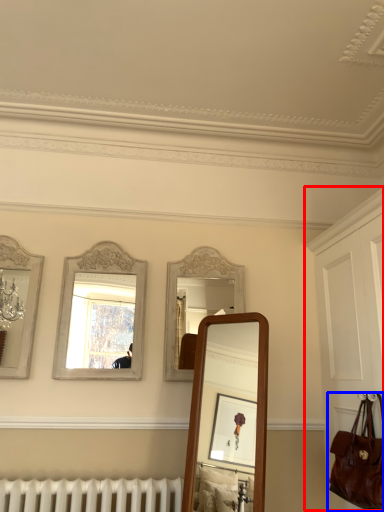
Question: Among these objects, which one is farthest to the camera, dresser (highlighted by a red box) or handbag (highlighted by a blue box)?

Choices:
 (A) dresser
 (B) handbag

Answer: (B)